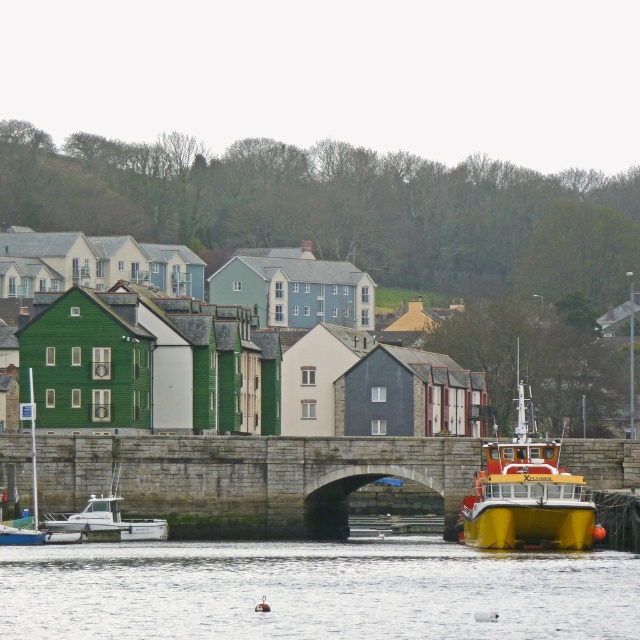
You are standing on the riverside path and want to cross to the other side. The stone bridge at center is the only structure connecting both banks. Can you see the transparent water at lower center from where you are standing? Explain why or why not based on their heights.

The transparent water at lower center is shorter than the stone bridge at center, so the bridge is taller. Since you are on the riverside path, the bridge would likely block your view of the water below if it is taller. However, since the water is at lower center, it might still be visible depending on the bridge structure. But according to the height comparison, the bridge being taller could obscure the view unless you look under it.

Consider the image. You are planning to rent a boat for a short trip along the river. You see the yellow matte boat at right and the white matte boat at lower left. Which boat would be more suitable if you need more space for your group?

The yellow matte boat at right is larger in size than the white matte boat at lower left, so it would be more suitable for a group needing more space.

You are a tourist standing on the riverside path and want to take a photo of both the yellow matte boat at right and the white matte boat at lower left. Which boat should you position yourself closer to in order to include both in your camera frame without cropping either?

You should position yourself closer to the white matte boat at lower left since it is shorter than the yellow matte boat at right, allowing both to fit within the frame when positioned appropriately.